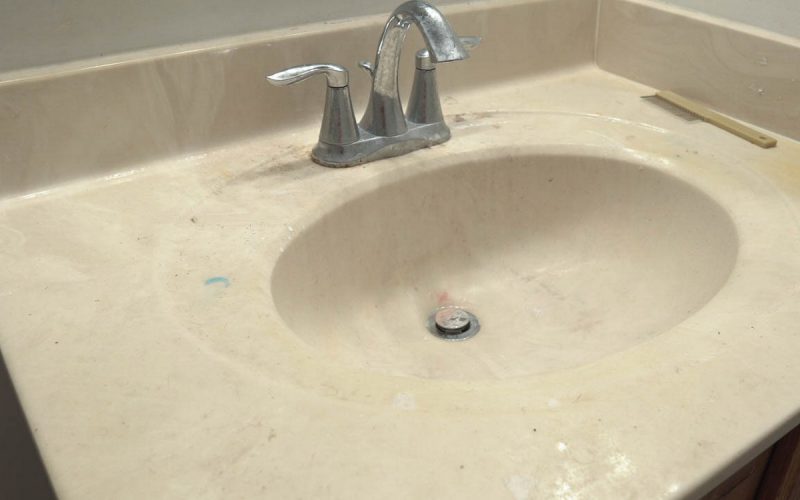
Locate an element on the screen. The image size is (800, 500). space in front of counter is located at coordinates (768, 477).